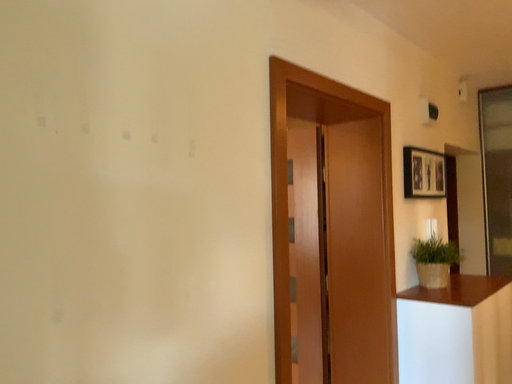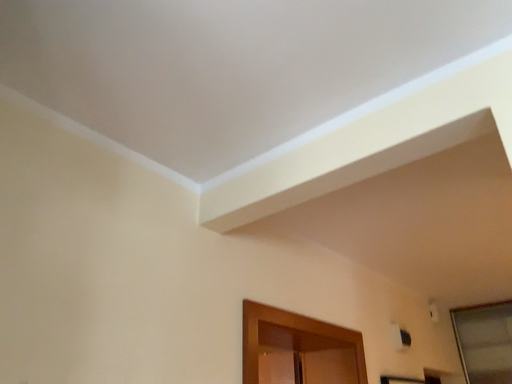
Question: Which way did the camera rotate in the video?

Choices:
 (A) rotated upward
 (B) rotated downward

Answer: (A)